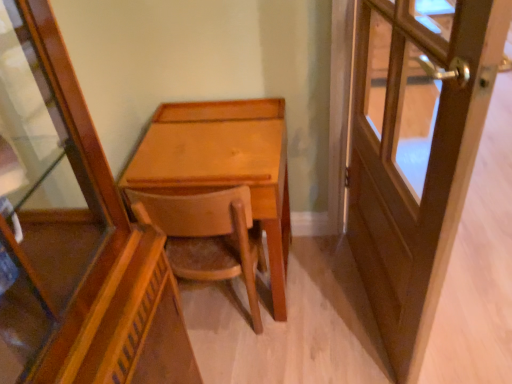
The height and width of the screenshot is (384, 512). What do you see at coordinates (223, 165) in the screenshot?
I see `light brown wood desk at center` at bounding box center [223, 165].

Locate an element on the screen. This screenshot has height=384, width=512. wooden door at right is located at coordinates (416, 152).

In the scene shown: From a real-world perspective, between light brown wood desk at center and wooden door at right, who is vertically higher?

From a 3D spatial view, wooden door at right is above.

Is point (285, 151) farther from camera compared to point (428, 133)?

No.

Does light brown wood desk at center turn towards wooden door at right?

No, light brown wood desk at center is not turned towards wooden door at right.

Is wooden chair at center to the left of light brown wood desk at center from the viewer's perspective?

Indeed, wooden chair at center is positioned on the left side of light brown wood desk at center.

The image size is (512, 384). Find the location of `desk on the right side of wooden chair at center`. desk on the right side of wooden chair at center is located at coordinates (223, 165).

Does point (154, 204) come farther from viewer compared to point (239, 163)?

No, (154, 204) is in front of (239, 163).

Considering the sizes of wooden chair at center and light brown wood desk at center in the image, is wooden chair at center bigger or smaller than light brown wood desk at center?

wooden chair at center is smaller than light brown wood desk at center.

From a real-world perspective, who is located higher, wooden door at right or light brown wood desk at center?

wooden door at right is physically above.

You are a GUI agent. You are given a task and a screenshot of the screen. Output one action in this format:
    pyautogui.click(x=<x>, y=<y>)
    Task: Click on the door lying in front of the light brown wood desk at center
    This screenshot has height=384, width=512.
    Given the screenshot: What is the action you would take?
    pyautogui.click(x=416, y=152)

Is wooden door at right shorter than light brown wood desk at center?

No, wooden door at right is not shorter than light brown wood desk at center.

Looking at the image, does wooden door at right seem bigger or smaller compared to light brown wood desk at center?

In the image, wooden door at right appears to be smaller than light brown wood desk at center.

Who is taller, wooden door at right or wooden chair at center?

With more height is wooden door at right.

Which is closer, (421, 85) or (133, 208)?

Point (421, 85) is farther from the camera than point (133, 208).

Which is more to the left, wooden door at right or wooden chair at center?

wooden chair at center.

From a real-world perspective, is light brown wood desk at center on wooden chair at center?

Indeed, from a real-world perspective, light brown wood desk at center stands above wooden chair at center.

Does light brown wood desk at center lie behind wooden chair at center?

Yes, it is.

Consider the image. Can you tell me how much light brown wood desk at center and wooden chair at center differ in facing direction?

light brown wood desk at center and wooden chair at center are facing 178 degrees away from each other.

Who is bigger, wooden chair at center or wooden door at right?

wooden door at right.

Is wooden chair at center not inside wooden door at right?

Yes, wooden chair at center is not within wooden door at right.

From their relative heights in the image, would you say wooden chair at center is taller or shorter than wooden door at right?

Clearly, wooden chair at center is shorter compared to wooden door at right.

From the image's perspective, is wooden chair at center positioned above or below wooden door at right?

wooden chair at center is situated lower than wooden door at right in the image.

At what (x,y) coordinates should I click in order to perform the action: click on desk below the wooden door at right (from the image's perspective). Please return your answer as a coordinate pair (x, y). Looking at the image, I should click on (223, 165).

Locate an element on the screen. Image resolution: width=512 pixels, height=384 pixels. desk behind the wooden chair at center is located at coordinates pos(223,165).

Considering their positions, is wooden door at right positioned further to light brown wood desk at center than wooden chair at center?

wooden door at right is positioned further to the anchor light brown wood desk at center.

Based on their spatial positions, is wooden chair at center or wooden door at right further from light brown wood desk at center?

wooden door at right lies further to light brown wood desk at center than the other object.

Considering their positions, is wooden door at right positioned further to wooden chair at center than light brown wood desk at center?

wooden door at right is further to wooden chair at center.

Looking at the image, which one is located closer to wooden door at right, wooden chair at center or light brown wood desk at center?

The object closer to wooden door at right is light brown wood desk at center.

From the image, which object appears to be nearer to wooden door at right, light brown wood desk at center or wooden chair at center?

light brown wood desk at center is closer to wooden door at right.

From the image, which object appears to be nearer to wooden chair at center, light brown wood desk at center or wooden door at right?

The object closer to wooden chair at center is light brown wood desk at center.

This screenshot has height=384, width=512. Find the location of `desk located between wooden chair at center and wooden door at right in the left-right direction`. desk located between wooden chair at center and wooden door at right in the left-right direction is located at coordinates (223, 165).